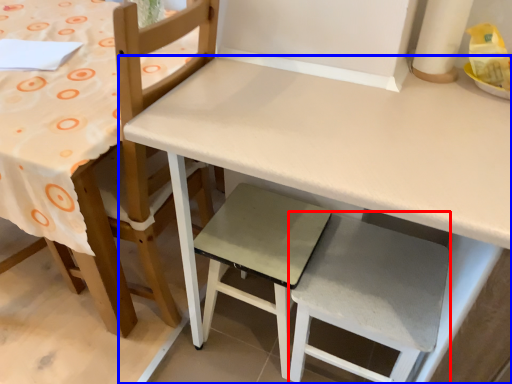
Question: Which point is closer to the camera, step stool (highlighted by a red box) or table (highlighted by a blue box)?

Choices:
 (A) step stool
 (B) table

Answer: (B)